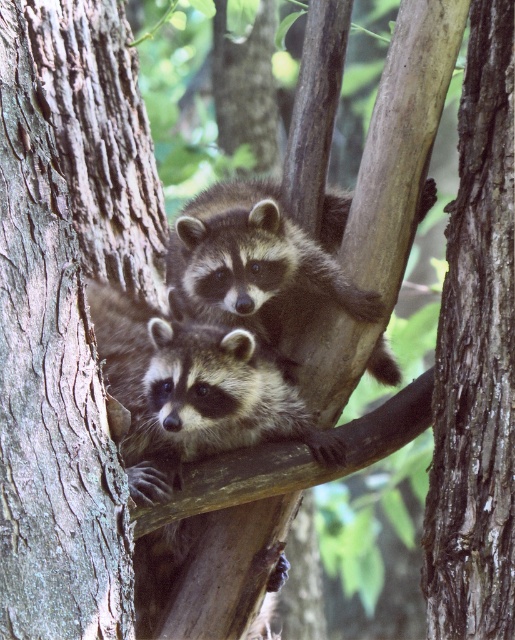
Consider the image. Can you confirm if smooth brown bark at left is shorter than dark brown fur raccoon at center?

In fact, smooth brown bark at left may be taller than dark brown fur raccoon at center.

Is point (79, 428) positioned behind point (203, 218)?

That is False.

Is point (36, 122) behind point (169, 300)?

No, it is in front of (169, 300).

Locate an element on the screen. The width and height of the screenshot is (515, 640). smooth brown bark at left is located at coordinates (66, 308).

Between smooth brown bark at left and brown rough bark tree trunk at center, which one is positioned higher?

smooth brown bark at left is above.

I want to click on smooth brown bark at left, so click(x=66, y=308).

Does point (506, 97) come behind point (228, 284)?

No, it is not.

Is point (487, 81) positioned before point (226, 288)?

Yes, point (487, 81) is in front of point (226, 288).

Which is behind, point (440, 538) or point (214, 250)?

Point (214, 250)

Locate an element on the screen. This screenshot has height=640, width=515. brown rough bark tree trunk at center is located at coordinates (476, 358).